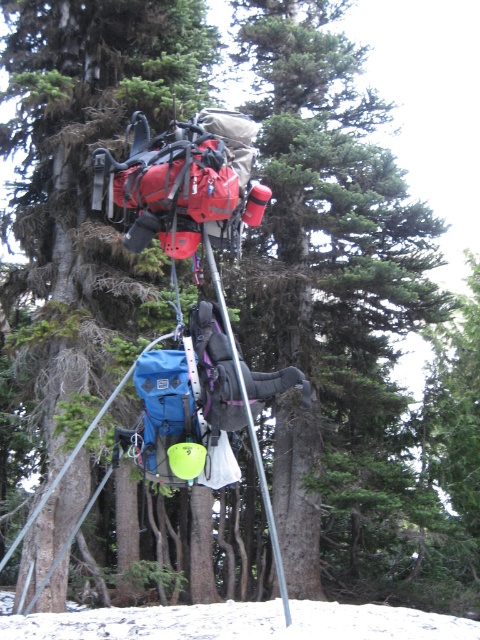
Which of these two, green matte backpack at center or white powdery snow at lower center, stands shorter?

Standing shorter between the two is white powdery snow at lower center.

Which of these two, green matte backpack at center or white powdery snow at lower center, stands taller?

Standing taller between the two is green matte backpack at center.

The width and height of the screenshot is (480, 640). In order to click on green matte backpack at center in this screenshot , I will do `click(87, 189)`.

Find the location of a particular element. This screenshot has height=640, width=480. green matte backpack at center is located at coordinates (87, 189).

Can you confirm if green matte tree at center is taller than white powdery snow at lower center?

Indeed, green matte tree at center has a greater height compared to white powdery snow at lower center.

Can you confirm if green matte tree at center is positioned to the left of white powdery snow at lower center?

No, green matte tree at center is not to the left of white powdery snow at lower center.

The width and height of the screenshot is (480, 640). What are the coordinates of `green matte tree at center` in the screenshot? It's located at (328, 269).

In the scene shown: Which of these two, green matte backpack at center or green matte tree at center, stands taller?

green matte tree at center

Does green matte backpack at center have a lesser height compared to green matte tree at center?

Yes.

Is point (159, 496) positioned after point (347, 161)?

Yes.

Image resolution: width=480 pixels, height=640 pixels. I want to click on green matte backpack at center, so click(87, 189).